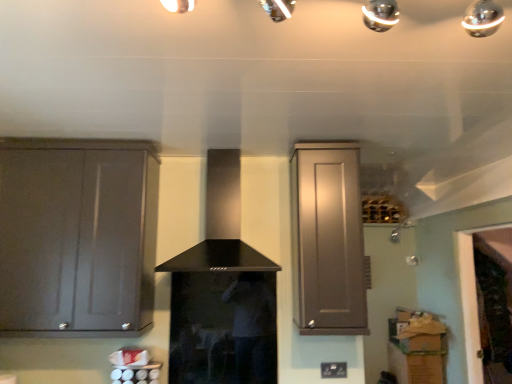
Question: Does matte gray cabinet at left, the first cabinetry from the left, turn towards black matte vent at center?

Choices:
 (A) yes
 (B) no

Answer: (B)

Question: Considering the relative positions of matte gray cabinet at left, the second cabinetry positioned from the right, and black matte vent at center in the image provided, is matte gray cabinet at left, the second cabinetry positioned from the right, behind black matte vent at center?

Choices:
 (A) yes
 (B) no

Answer: (A)

Question: Does matte gray cabinet at left, the second cabinetry positioned from the right, have a larger size compared to black matte vent at center?

Choices:
 (A) no
 (B) yes

Answer: (B)

Question: Is matte gray cabinet at left, the first cabinetry from the left, located outside black matte vent at center?

Choices:
 (A) no
 (B) yes

Answer: (B)

Question: Considering the relative sizes of matte gray cabinet at left, the first cabinetry from the left, and black matte vent at center in the image provided, is matte gray cabinet at left, the first cabinetry from the left, smaller than black matte vent at center?

Choices:
 (A) yes
 (B) no

Answer: (B)

Question: Does matte gray cabinet at left, the first cabinetry from the left, have a greater height compared to black matte vent at center?

Choices:
 (A) no
 (B) yes

Answer: (B)

Question: Is black matte vent at center not within matte gray cabinet at upper right, the first cabinetry positioned from the right?

Choices:
 (A) yes
 (B) no

Answer: (A)

Question: From the image's perspective, would you say black matte vent at center is shown under matte gray cabinet at upper right, the first cabinetry positioned from the right?

Choices:
 (A) yes
 (B) no

Answer: (B)

Question: Does black matte vent at center appear on the right side of matte gray cabinet at upper right, the 2th cabinetry when ordered from left to right?

Choices:
 (A) no
 (B) yes

Answer: (A)

Question: Is black matte vent at center far away from matte gray cabinet at upper right, the 2th cabinetry when ordered from left to right?

Choices:
 (A) yes
 (B) no

Answer: (B)

Question: From a real-world perspective, is black matte vent at center located beneath matte gray cabinet at upper right, the first cabinetry positioned from the right?

Choices:
 (A) no
 (B) yes

Answer: (A)

Question: Is black matte vent at center touching matte gray cabinet at upper right, the 2th cabinetry when ordered from left to right?

Choices:
 (A) no
 (B) yes

Answer: (A)

Question: From a real-world perspective, is matte gray cabinet at upper right, the 2th cabinetry when ordered from left to right, below black matte vent at center?

Choices:
 (A) no
 (B) yes

Answer: (B)